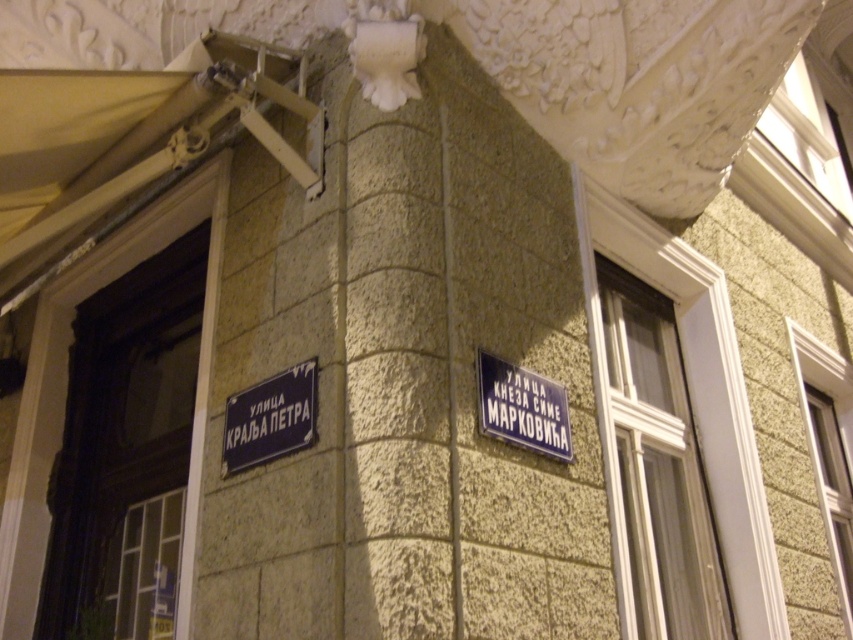
Which is more to the right, dark blue metal street sign at lower left or blue metallic sign at upper right?

Positioned to the right is blue metallic sign at upper right.

Between point (262, 417) and point (543, 397), which one is positioned behind?

The point (543, 397) is more distant.

The width and height of the screenshot is (853, 640). I want to click on dark blue metal street sign at lower left, so click(x=270, y=419).